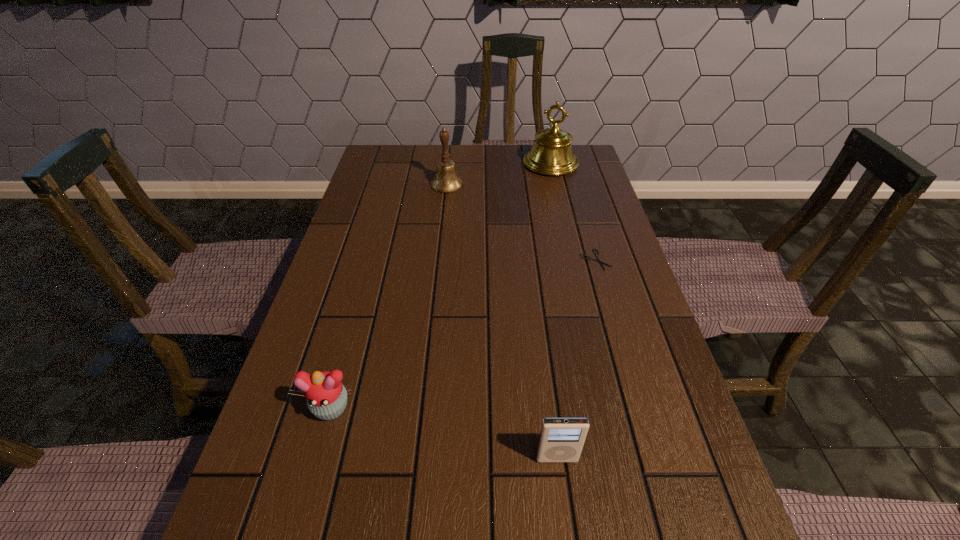
The image size is (960, 540). In order to click on the right bell in this screenshot , I will do `click(552, 154)`.

Find the location of a particular element. the left bell is located at coordinates (446, 180).

Where is `iPod`? iPod is located at coordinates (561, 439).

At what (x,y) coordinates should I click in order to perform the action: click on the leftmost object. Please return your answer as a coordinate pair (x, y). Looking at the image, I should click on (326, 396).

Find the location of a particular element. The image size is (960, 540). the second nearest object is located at coordinates (326, 396).

Where is `the shortest object`? The height and width of the screenshot is (540, 960). the shortest object is located at coordinates (589, 258).

The height and width of the screenshot is (540, 960). Find the location of `the third farthest object`. the third farthest object is located at coordinates 589,258.

Locate an element on the screen. vacant space located 0.350m on the front of the right bell is located at coordinates (570, 245).

This screenshot has width=960, height=540. What are the coordinates of `free spot located 0.080m on the left of the second object from left to right` in the screenshot? It's located at (405, 185).

Where is `free space located 0.100m on the face of the leftmost object`? free space located 0.100m on the face of the leftmost object is located at coordinates (311, 481).